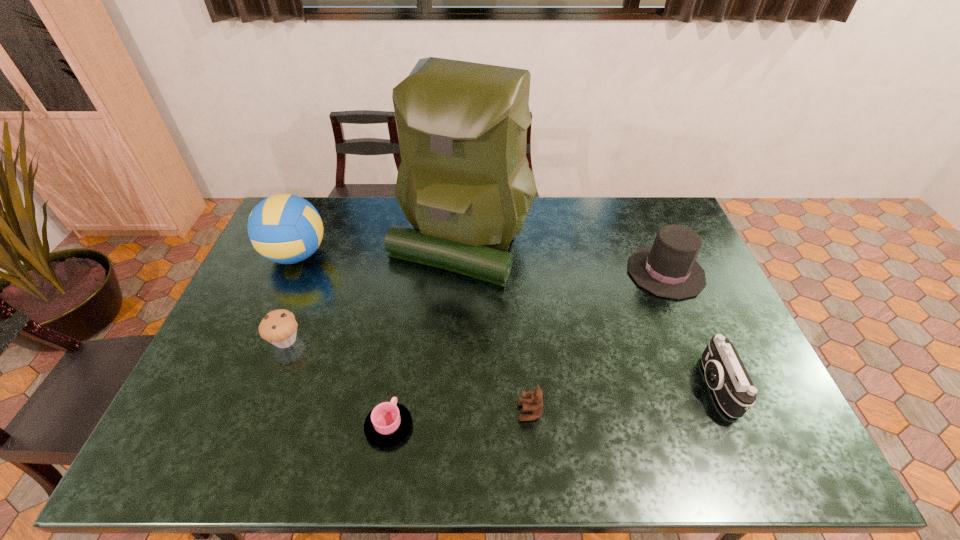
The width and height of the screenshot is (960, 540). I want to click on the tallest object, so click(464, 183).

Identify the location of the sixth shortest object. The width and height of the screenshot is (960, 540). (284, 228).

Locate an element on the screen. the third tallest object is located at coordinates (668, 269).

Identify the location of the fourth tallest object. The width and height of the screenshot is (960, 540). (725, 373).

Locate an element on the screen. muffin is located at coordinates (279, 327).

Image resolution: width=960 pixels, height=540 pixels. I want to click on teddy bear, so click(x=535, y=404).

At what (x,y) coordinates should I click in order to perform the action: click on cup. Please return your answer as a coordinate pair (x, y). Looking at the image, I should click on point(389,423).

Where is `free spot located on the front of the tallest object with visible pockets`? The height and width of the screenshot is (540, 960). free spot located on the front of the tallest object with visible pockets is located at coordinates (458, 313).

The image size is (960, 540). I want to click on vacant area situated on the right of the second tallest object, so click(424, 255).

Identify the location of vacant region located on the front of the fifth shortest object with the decoration. (593, 272).